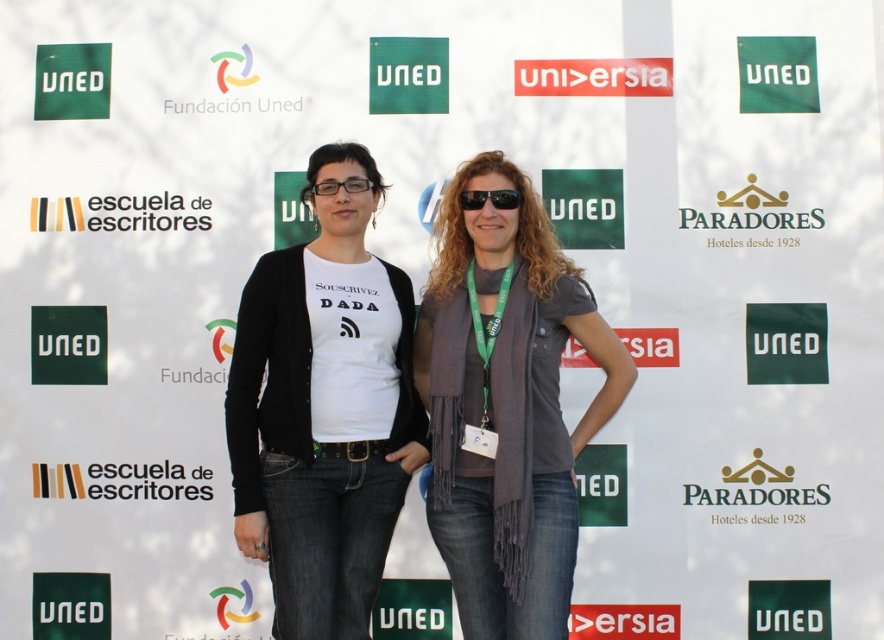
You are a photographer adjusting your camera settings. You notice two pairs of glasses on the person in the image. The first is the black reflective sunglasses at center, and the second is the black plastic glasses at center. Which pair appears closer to you?

The black reflective sunglasses at center appears closer to you because it is closer to the viewer than the black plastic glasses at center.

You are a photographer adjusting your camera settings to focus on the gray scarf at center and the black plastic glasses at center. Which object should you focus on first to ensure both are in focus?

You should focus on the gray scarf at center first since it is closer to the viewer than the black plastic glasses at center, allowing the camera to adjust focus starting from the closer object.